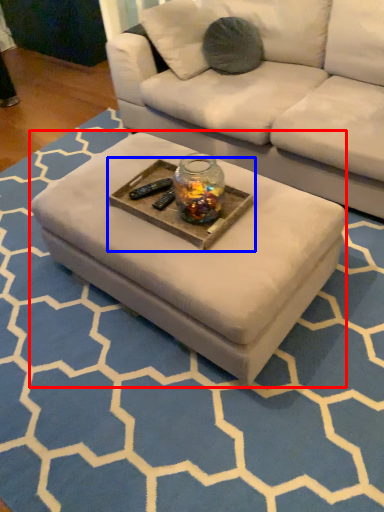
Question: Among these objects, which one is farthest to the camera, coffee table (highlighted by a red box) or round table (highlighted by a blue box)?

Choices:
 (A) coffee table
 (B) round table

Answer: (B)